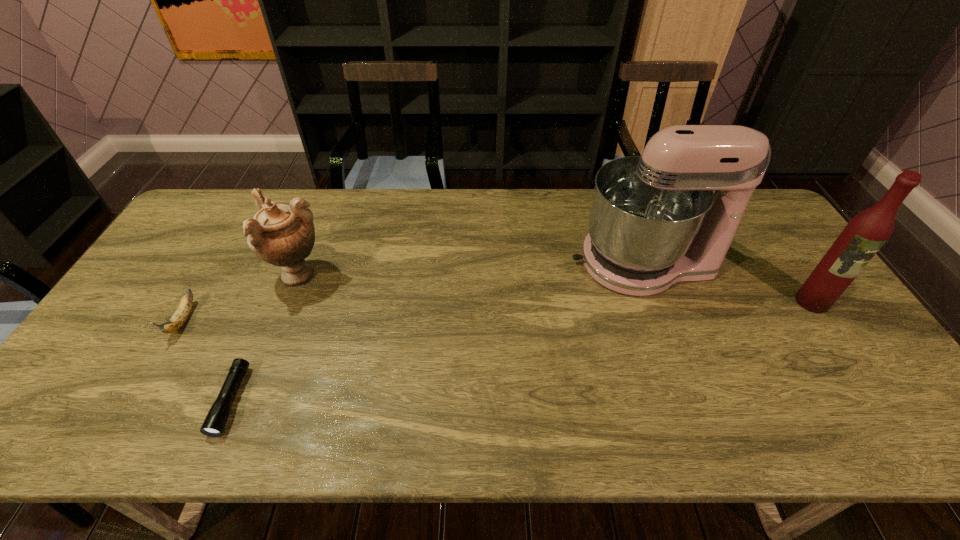
Image resolution: width=960 pixels, height=540 pixels. Find the location of `mixer`. mixer is located at coordinates (656, 213).

You are a GUI agent. You are given a task and a screenshot of the screen. Output one action in this format:
    pyautogui.click(x=<x>, y=<y>)
    Task: Click on the liquor
    
    Given the screenshot: What is the action you would take?
    pyautogui.click(x=864, y=235)

The height and width of the screenshot is (540, 960). In order to click on the third tallest object in this screenshot , I will do `click(282, 235)`.

Find the location of a particular element. The width and height of the screenshot is (960, 540). the second shortest object is located at coordinates (178, 319).

Where is `banana`? This screenshot has height=540, width=960. banana is located at coordinates (178, 319).

This screenshot has height=540, width=960. I want to click on the shortest object, so pos(216,419).

The height and width of the screenshot is (540, 960). What are the coordinates of `the nearest object` in the screenshot? It's located at (216, 419).

You are a GUI agent. You are given a task and a screenshot of the screen. Output one action in this format:
    pyautogui.click(x=<x>, y=<y>)
    Task: Click on the vacant space positioned 0.330m on the front-facing side of the mixer
    The width and height of the screenshot is (960, 540).
    Given the screenshot: What is the action you would take?
    pyautogui.click(x=463, y=263)

Identify the location of free point located on the front-facing side of the mixer. (479, 263).

Where is `blank space located on the front-facing side of the mixer`? blank space located on the front-facing side of the mixer is located at coordinates (522, 263).